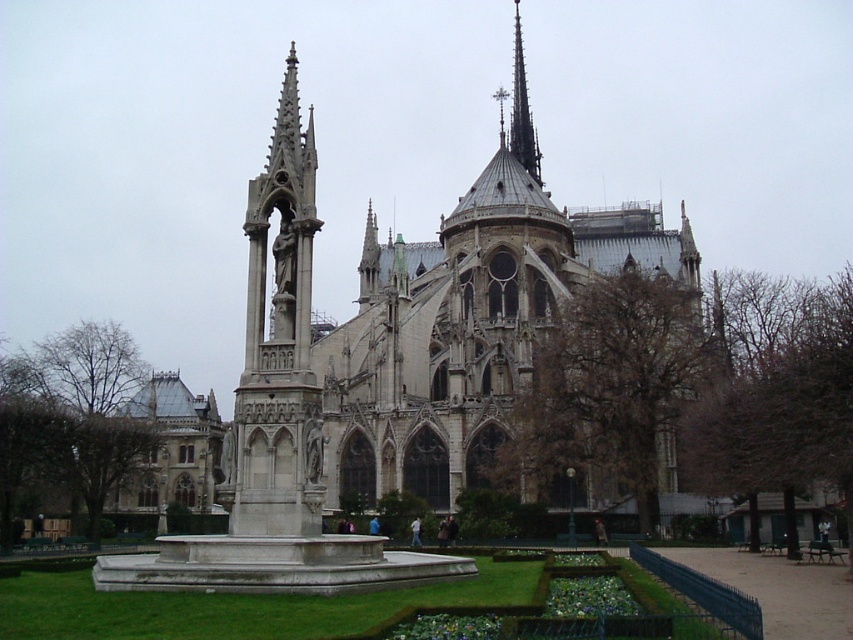
Identify the location of white stone church at center. The height and width of the screenshot is (640, 853). (463, 349).

Can you confirm if white stone church at center is shorter than smooth gray spire at upper center?

Incorrect, white stone church at center's height does not fall short of smooth gray spire at upper center's.

Locate an element on the screen. The width and height of the screenshot is (853, 640). white stone church at center is located at coordinates (463, 349).